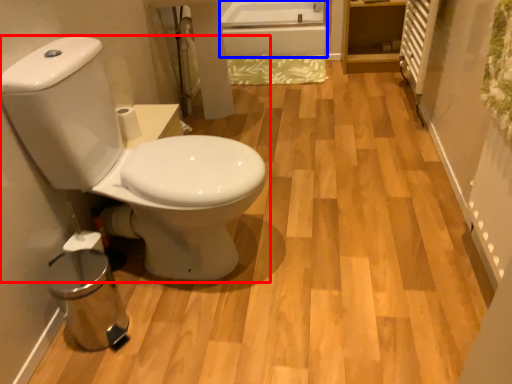
Question: Which object is further to the camera taking this photo, toilet (highlighted by a red box) or bath (highlighted by a blue box)?

Choices:
 (A) toilet
 (B) bath

Answer: (B)